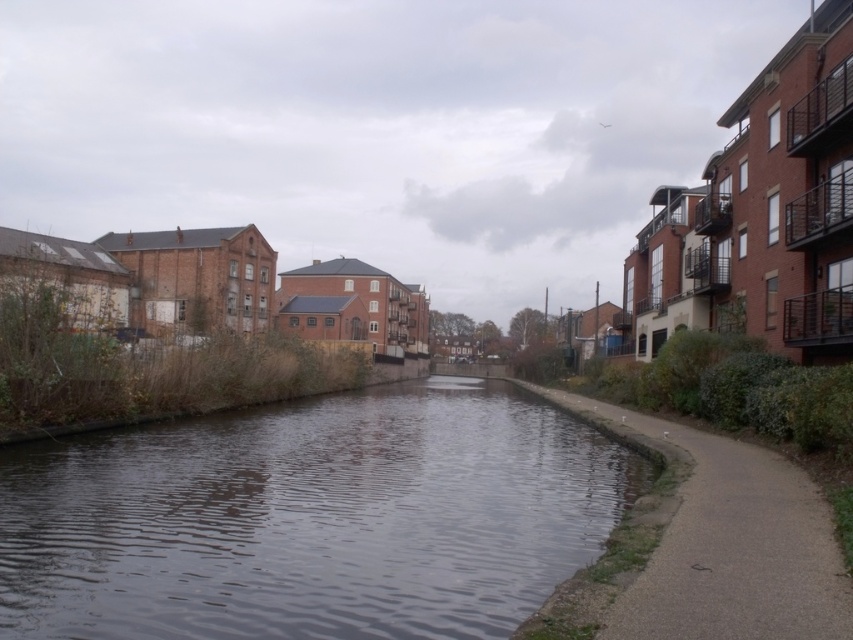
You are standing on the walkway next to the canal and see the point at coordinates (x=310, y=518). What is located at that point?

The point at coordinates (x=310, y=518) indicates dark water at center.

You are a delivery drone flying over the canal scene. You need to land on the gray concrete pavement at lower right. However, you must avoid the dark water at center. Based on their widths, can you safely land on the pavement without touching the water?

The dark water at center is wider than the gray concrete pavement at lower right. Therefore, the drone should be cautious as the water spans a greater distance, but since the pavement is at lower right, it might still be accessible if navigated carefully.